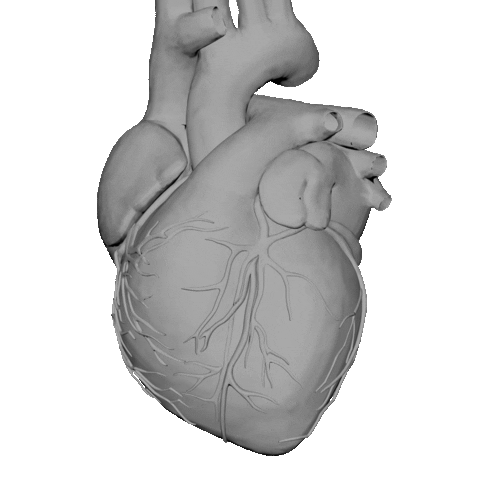
Locate an element on the screen. organ is located at coordinates (118, 170).